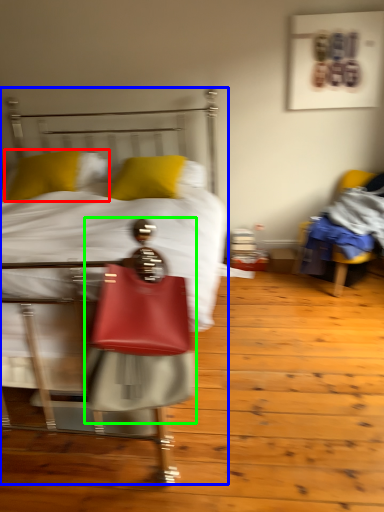
Question: Based on their relative distances, which object is farther from pillow (highlighted by a red box)? Choose from bed (highlighted by a blue box) and person (highlighted by a green box).

Choices:
 (A) bed
 (B) person

Answer: (B)